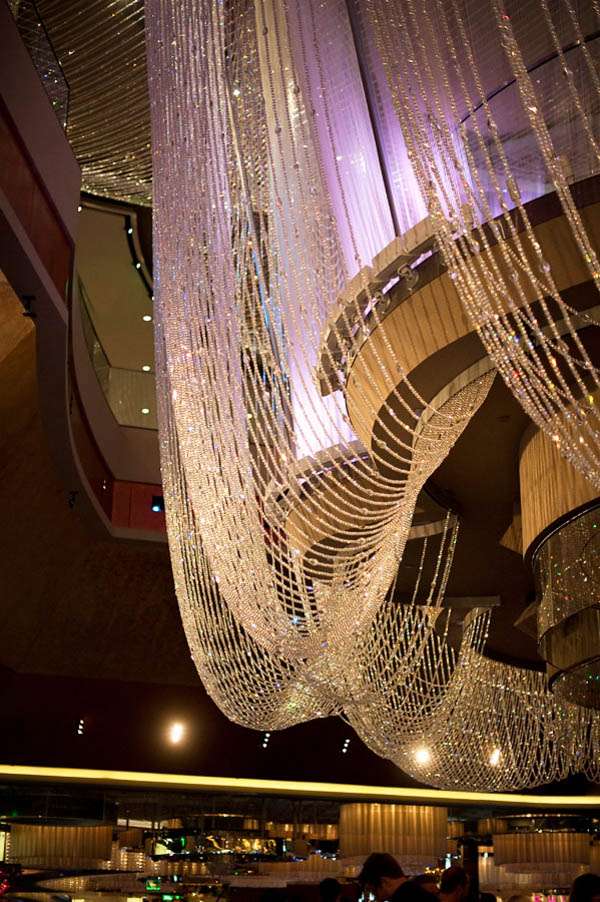
Image resolution: width=600 pixels, height=902 pixels. Identify the location of light fixtures. (390, 841), (542, 856), (55, 848), (92, 884).